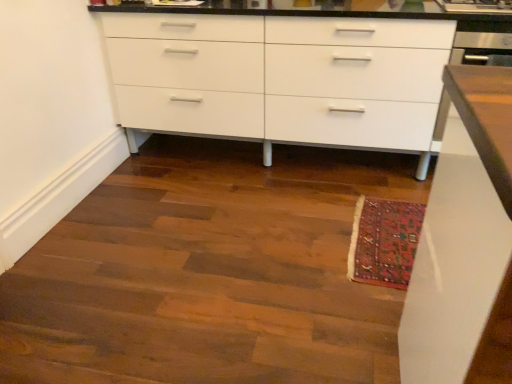
Question: Does wooden floor at lower center have a lesser height compared to carpeted mat at lower right?

Choices:
 (A) no
 (B) yes

Answer: (B)

Question: Would you say carpeted mat at lower right is part of wooden floor at lower center's contents?

Choices:
 (A) no
 (B) yes

Answer: (B)

Question: Is wooden floor at lower center outside of carpeted mat at lower right?

Choices:
 (A) yes
 (B) no

Answer: (A)

Question: Is the position of wooden floor at lower center more distant than that of carpeted mat at lower right?

Choices:
 (A) no
 (B) yes

Answer: (A)

Question: Can you confirm if wooden floor at lower center is taller than carpeted mat at lower right?

Choices:
 (A) no
 (B) yes

Answer: (A)

Question: Does wooden floor at lower center lie in front of carpeted mat at lower right?

Choices:
 (A) yes
 (B) no

Answer: (A)

Question: Does carpeted mat at lower right turn towards white glossy cabinet at center?

Choices:
 (A) no
 (B) yes

Answer: (A)

Question: Is carpeted mat at lower right thinner than white glossy cabinet at center?

Choices:
 (A) yes
 (B) no

Answer: (A)

Question: Is carpeted mat at lower right not inside white glossy cabinet at center?

Choices:
 (A) yes
 (B) no

Answer: (A)

Question: Considering the relative positions of carpeted mat at lower right and white glossy cabinet at center in the image provided, is carpeted mat at lower right to the right of white glossy cabinet at center from the viewer's perspective?

Choices:
 (A) yes
 (B) no

Answer: (A)

Question: Can you confirm if carpeted mat at lower right is positioned to the left of white glossy cabinet at center?

Choices:
 (A) yes
 (B) no

Answer: (B)

Question: From the image's perspective, is carpeted mat at lower right above white glossy cabinet at center?

Choices:
 (A) yes
 (B) no

Answer: (B)

Question: Does white glossy cabinet at center appear on the left side of wooden floor at lower center?

Choices:
 (A) yes
 (B) no

Answer: (B)